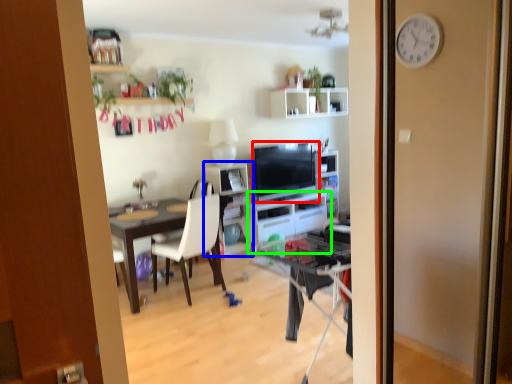
Question: Which is farther away from television (highlighted by a red box)? shelf (highlighted by a blue box) or cabinetry (highlighted by a green box)?

Choices:
 (A) shelf
 (B) cabinetry

Answer: (A)